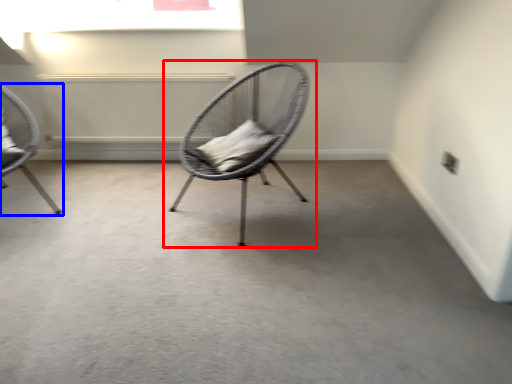
Question: Which point is closer to the camera, chair (highlighted by a red box) or chair (highlighted by a blue box)?

Choices:
 (A) chair
 (B) chair

Answer: (A)